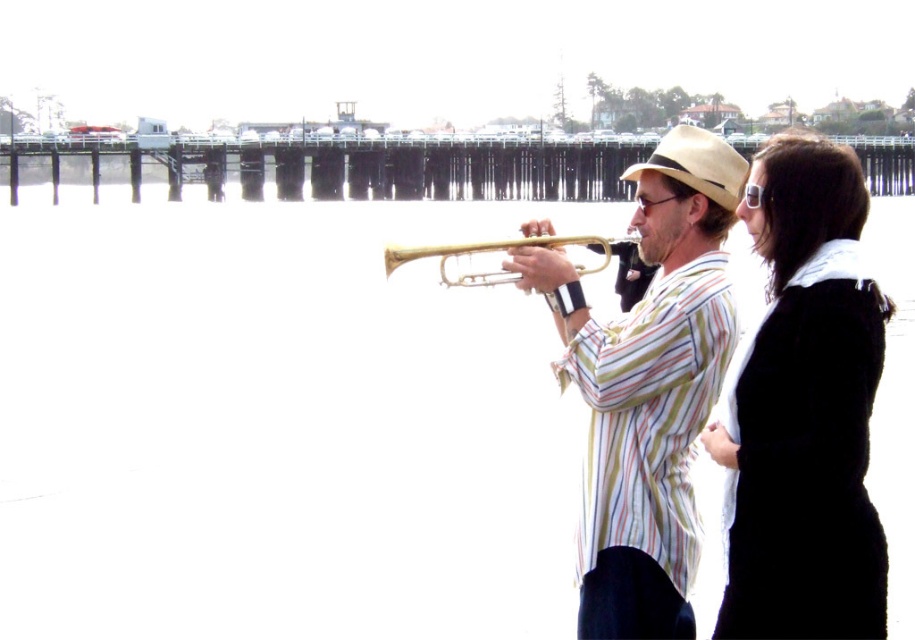
You are a photographer planning to take a portrait of the two people in the scene. You want to ensure that the gold shiny trumpet at center and the beige felt cowboy hat at center are both clearly visible in the frame. Based on their positions, which object is closer to the camera?

The gold shiny trumpet at center is positioned under the beige felt cowboy hat at center, so the trumpet is closer to the camera than the hat.

Based on the photo, you are a photographer trying to capture both the gold shiny trumpet at center and the gold brass trumpet at center in the same frame. Given that your camera has a maximum focus range of 4 meters, will you be able to get both in focus at the same time?

The gold shiny trumpet at center and gold brass trumpet at center are 4.42 meters apart. Since the distance between them exceeds the camera maximum focus range of 4 meters, you will not be able to get both in focus at the same time.

You are a photographer positioned at the center of the scene. You want to take a photo that includes both the black velvet coat at right and the beige felt cowboy hat at center. What is the minimum distance you need to move to ensure both are in frame?

The minimum distance you need to move is 14.46 meters divided by 2, which is 7.23 meters, so you should move 7.23 meters towards the direction that centers both the black velvet coat at right and the beige felt cowboy hat at center.